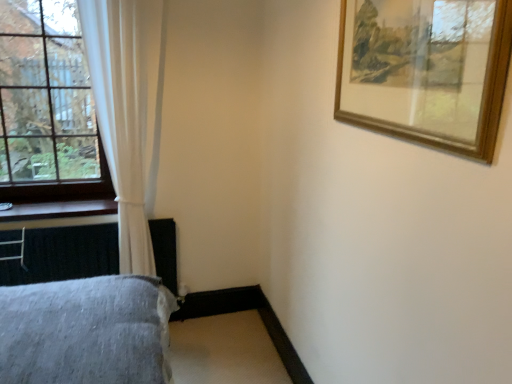
Question: From the image's perspective, is clear glass window at left over wooden at left?

Choices:
 (A) yes
 (B) no

Answer: (A)

Question: From the image's perspective, is clear glass window at left located beneath wooden at left?

Choices:
 (A) yes
 (B) no

Answer: (B)

Question: Does clear glass window at left have a larger size compared to wooden at left?

Choices:
 (A) yes
 (B) no

Answer: (A)

Question: Does clear glass window at left have a lesser width compared to wooden at left?

Choices:
 (A) no
 (B) yes

Answer: (B)

Question: Considering the relative sizes of clear glass window at left and wooden at left in the image provided, is clear glass window at left taller than wooden at left?

Choices:
 (A) yes
 (B) no

Answer: (A)

Question: From the image's perspective, is wooden at left positioned above or below clear glass window at left?

Choices:
 (A) below
 (B) above

Answer: (A)

Question: Is point (10, 215) closer or farther from the camera than point (41, 97)?

Choices:
 (A) farther
 (B) closer

Answer: (B)

Question: Is wooden at left spatially inside clear glass window at left, or outside of it?

Choices:
 (A) inside
 (B) outside

Answer: (B)

Question: Based on their positions, is wooden at left located to the left or right of clear glass window at left?

Choices:
 (A) left
 (B) right

Answer: (B)

Question: Is wooden picture frame at upper right taller or shorter than gray fabric bed at lower left?

Choices:
 (A) short
 (B) tall

Answer: (A)

Question: In terms of width, does wooden picture frame at upper right look wider or thinner when compared to gray fabric bed at lower left?

Choices:
 (A) thin
 (B) wide

Answer: (B)

Question: Considering their positions, is wooden picture frame at upper right located in front of or behind gray fabric bed at lower left?

Choices:
 (A) behind
 (B) front

Answer: (B)

Question: Is wooden picture frame at upper right to the left or to the right of gray fabric bed at lower left in the image?

Choices:
 (A) left
 (B) right

Answer: (B)

Question: In the image, is white sheer curtain at left positioned in front of or behind clear glass window at left?

Choices:
 (A) behind
 (B) front

Answer: (B)

Question: Considering the positions of point (121, 31) and point (12, 170), is point (121, 31) closer or farther from the camera than point (12, 170)?

Choices:
 (A) closer
 (B) farther

Answer: (A)